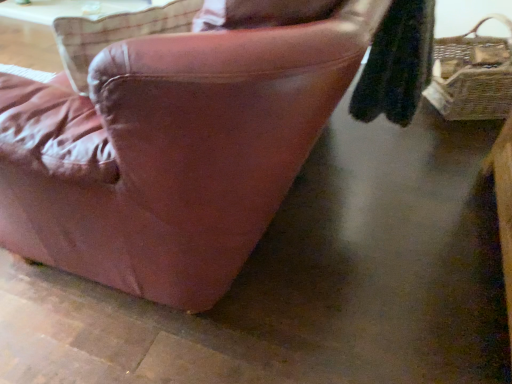
Question: Is leather couch at center inside the boundaries of natural wicker picnic basket at right, or outside?

Choices:
 (A) inside
 (B) outside

Answer: (B)

Question: From a real-world perspective, is leather couch at center positioned above or below natural wicker picnic basket at right?

Choices:
 (A) below
 (B) above

Answer: (A)

Question: Considering their positions, is leather couch at center located in front of or behind natural wicker picnic basket at right?

Choices:
 (A) front
 (B) behind

Answer: (A)

Question: Is natural wicker picnic basket at right in front of or behind leather couch at center in the image?

Choices:
 (A) behind
 (B) front

Answer: (A)

Question: Looking at their shapes, would you say natural wicker picnic basket at right is wider or thinner than leather couch at center?

Choices:
 (A) wide
 (B) thin

Answer: (B)

Question: Would you say natural wicker picnic basket at right is to the left or to the right of leather couch at center in the picture?

Choices:
 (A) left
 (B) right

Answer: (B)

Question: From a real-world perspective, is natural wicker picnic basket at right above or below leather couch at center?

Choices:
 (A) below
 (B) above

Answer: (B)